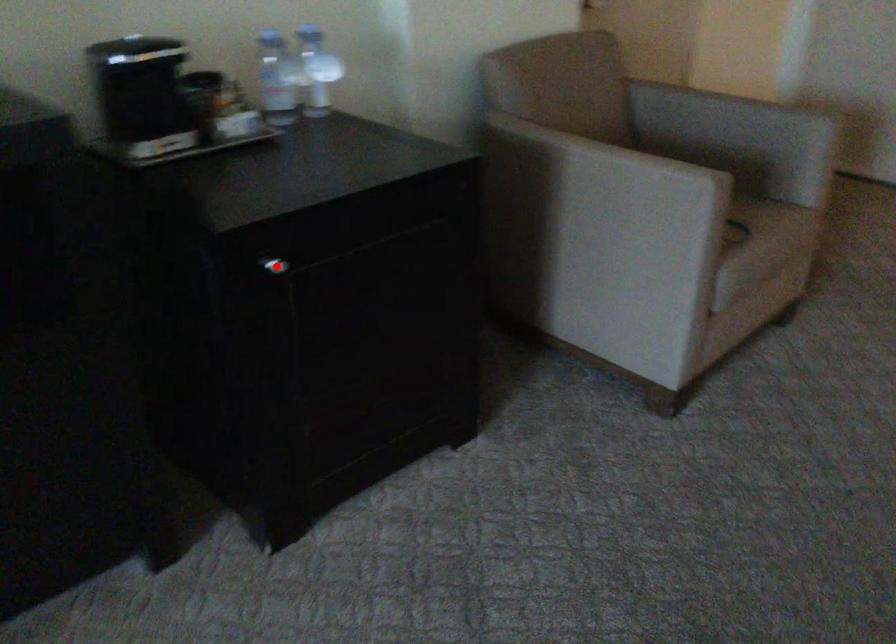
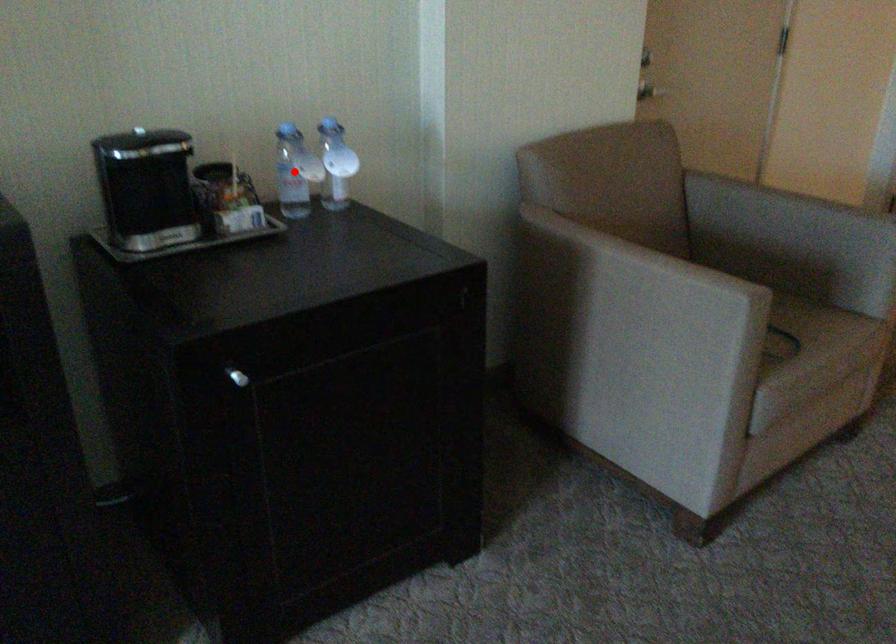
I am providing you with two images of the same scene from different viewpoints. A red point is marked on the first image and another point is marked on the second image. Is the marked point in image1 the same physical position as the marked point in image2?

No